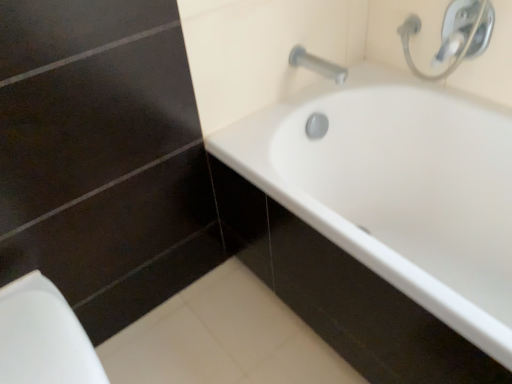
Question: Can you see white glossy porcelain at lower left touching silver metallic tap at upper right?

Choices:
 (A) no
 (B) yes

Answer: (A)

Question: Can you confirm if white glossy porcelain at lower left is positioned to the right of silver metallic tap at upper right?

Choices:
 (A) yes
 (B) no

Answer: (B)

Question: Does white glossy porcelain at lower left have a greater height compared to silver metallic tap at upper right?

Choices:
 (A) no
 (B) yes

Answer: (B)

Question: Is white glossy porcelain at lower left positioned far away from silver metallic tap at upper right?

Choices:
 (A) no
 (B) yes

Answer: (A)

Question: Is white glossy porcelain at lower left bigger than silver metallic tap at upper right?

Choices:
 (A) no
 (B) yes

Answer: (B)

Question: From the image's perspective, is white glossy porcelain at lower left located beneath silver metallic tap at upper right?

Choices:
 (A) yes
 (B) no

Answer: (A)

Question: Does silver metallic tap at upper right have a lesser height compared to silver metallic faucet at upper right?

Choices:
 (A) no
 (B) yes

Answer: (B)

Question: Can you confirm if silver metallic tap at upper right is thinner than silver metallic faucet at upper right?

Choices:
 (A) no
 (B) yes

Answer: (A)

Question: Does silver metallic tap at upper right appear on the left side of silver metallic faucet at upper right?

Choices:
 (A) no
 (B) yes

Answer: (B)

Question: Is the surface of silver metallic tap at upper right in direct contact with silver metallic faucet at upper right?

Choices:
 (A) no
 (B) yes

Answer: (A)

Question: Considering the relative sizes of silver metallic tap at upper right and silver metallic faucet at upper right in the image provided, is silver metallic tap at upper right smaller than silver metallic faucet at upper right?

Choices:
 (A) yes
 (B) no

Answer: (A)

Question: Would you say silver metallic tap at upper right is a long distance from silver metallic faucet at upper right?

Choices:
 (A) yes
 (B) no

Answer: (B)

Question: Does white glossy bathtub at center appear on the left side of silver metallic tap at upper right?

Choices:
 (A) no
 (B) yes

Answer: (A)